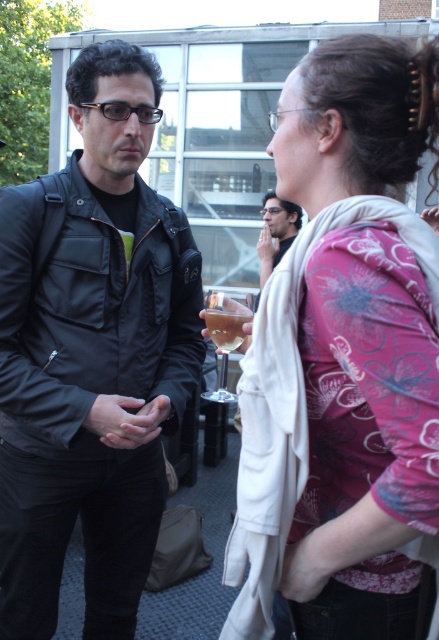
You are a photographer trying to capture a closeup shot of the clear glass wine glass at center without the pink floral sweater at upper right appearing in the frame. Given their sizes, is this possible?

The pink floral sweater at upper right is wider than the clear glass wine glass at center. Therefore, it might be challenging to frame the wine glass without the sweater overlapping, unless you adjust your angle or zoom in closely.

In the scene shown: You are at a rooftop party and see the clear glass wine glass at center and the matte black jacket at center. Which object is positioned lower in the image?

The clear glass wine glass at center is located below the matte black jacket at center, so it is positioned lower in the image.

You are a photographer at the event and want to capture a shot of the pink floral sweater at upper right and the clear glass wine glass at center. Since the pink floral sweater is covering part of the wine glass, how can you adjust your position to ensure both are fully visible?

Since the pink floral sweater at upper right is positioned over the clear glass wine glass at center, you can move to the side so that the sweater is no longer blocking the glass. This will allow both objects to be fully visible in the photo.